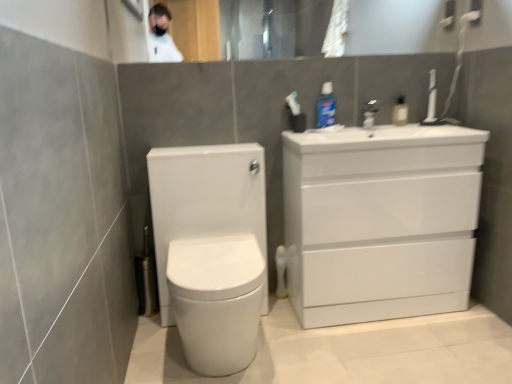
Find the location of `white glossy toilet at center`. white glossy toilet at center is located at coordinates pyautogui.click(x=211, y=249).

Image resolution: width=512 pixels, height=384 pixels. Describe the element at coordinates (326, 107) in the screenshot. I see `blue glossy mouthwash at upper center, the 1th toiletry when ordered from left to right` at that location.

You are a GUI agent. You are given a task and a screenshot of the screen. Output one action in this format:
    pyautogui.click(x=<x>, y=<y>)
    Task: Click on the clear plastic bottle at upper center, which is the 1th toiletry in right-to-left order
    This screenshot has height=384, width=512.
    Given the screenshot: What is the action you would take?
    pyautogui.click(x=400, y=112)

Where is `white glossy cabinet at right`? This screenshot has height=384, width=512. white glossy cabinet at right is located at coordinates (381, 221).

I want to click on white glossy toilet at center, so click(211, 249).

Between satin nickel faucet at upper center and clear plastic bottle at upper center, which is the 1th toiletry in right-to-left order, which one has smaller size?

Smaller between the two is satin nickel faucet at upper center.

Could you tell me if satin nickel faucet at upper center is facing clear plastic bottle at upper center, which is the 1th toiletry in right-to-left order?

No, satin nickel faucet at upper center is not aimed at clear plastic bottle at upper center, which is the 1th toiletry in right-to-left order.

Based on the photo, visually, is satin nickel faucet at upper center positioned to the left or to the right of clear plastic bottle at upper center, which is the 1th toiletry in right-to-left order?

satin nickel faucet at upper center is to the left of clear plastic bottle at upper center, which is the 1th toiletry in right-to-left order.

Considering the relative sizes of satin nickel faucet at upper center and clear plastic bottle at upper center, which is the 1th toiletry in right-to-left order, in the image provided, is satin nickel faucet at upper center thinner than clear plastic bottle at upper center, which is the 1th toiletry in right-to-left order,?

Correct, the width of satin nickel faucet at upper center is less than that of clear plastic bottle at upper center, which is the 1th toiletry in right-to-left order.

Consider the image. From the image's perspective, would you say glossy glass mirror at upper center is shown under white glossy toilet at center?

No, from the image's perspective, glossy glass mirror at upper center is not beneath white glossy toilet at center.

From a real-world perspective, between glossy glass mirror at upper center and white glossy toilet at center, who is vertically higher?

glossy glass mirror at upper center is physically above.

Based on the photo, considering the sizes of glossy glass mirror at upper center and white glossy toilet at center in the image, is glossy glass mirror at upper center bigger or smaller than white glossy toilet at center?

glossy glass mirror at upper center is smaller than white glossy toilet at center.

Would you say glossy glass mirror at upper center is a long distance from white glossy toilet at center?

Indeed, glossy glass mirror at upper center is not near white glossy toilet at center.

From the picture: Does blue glossy mouthwash at upper center, the 1th toiletry when ordered from left to right, have a greater width compared to satin nickel faucet at upper center?

Correct, the width of blue glossy mouthwash at upper center, the 1th toiletry when ordered from left to right, exceeds that of satin nickel faucet at upper center.

How many degrees apart are the facing directions of blue glossy mouthwash at upper center, the 1th toiletry when ordered from left to right, and satin nickel faucet at upper center?

They differ by 0.000755 degrees in their facing directions.

Which point is more distant from viewer, (325, 85) or (367, 124)?

The point (325, 85) is farther.

From the picture: Does blue glossy mouthwash at upper center, which is the second toiletry from right to left, have a smaller size compared to satin nickel faucet at upper center?

Actually, blue glossy mouthwash at upper center, which is the second toiletry from right to left, might be larger than satin nickel faucet at upper center.

Considering the sizes of objects blue glossy mouthwash at upper center, which is the second toiletry from right to left, and white glossy cabinet at right in the image provided, who is thinner, blue glossy mouthwash at upper center, which is the second toiletry from right to left, or white glossy cabinet at right?

Thinner between the two is blue glossy mouthwash at upper center, which is the second toiletry from right to left.

How many degrees apart are the facing directions of blue glossy mouthwash at upper center, the 1th toiletry when ordered from left to right, and white glossy cabinet at right?

0.805 degrees.

Is blue glossy mouthwash at upper center, which is the second toiletry from right to left, oriented away from white glossy cabinet at right?

blue glossy mouthwash at upper center, which is the second toiletry from right to left, is not turned away from white glossy cabinet at right.

Is blue glossy mouthwash at upper center, the 1th toiletry when ordered from left to right, shorter than white glossy cabinet at right?

Correct, blue glossy mouthwash at upper center, the 1th toiletry when ordered from left to right, is not as tall as white glossy cabinet at right.

Does white glossy toilet at center have a smaller size compared to satin nickel faucet at upper center?

Incorrect, white glossy toilet at center is not smaller in size than satin nickel faucet at upper center.

How many degrees apart are the facing directions of white glossy toilet at center and satin nickel faucet at upper center?

They differ by 0.805 degrees in their facing directions.

From the image's perspective, which one is positioned lower, white glossy toilet at center or satin nickel faucet at upper center?

white glossy toilet at center, from the image's perspective.

Are white glossy toilet at center and satin nickel faucet at upper center making contact?

white glossy toilet at center and satin nickel faucet at upper center are not in contact.

In the scene shown: Considering the relative sizes of white glossy cabinet at right and satin nickel faucet at upper center in the image provided, is white glossy cabinet at right thinner than satin nickel faucet at upper center?

In fact, white glossy cabinet at right might be wider than satin nickel faucet at upper center.

Is white glossy cabinet at right in contact with satin nickel faucet at upper center?

No, white glossy cabinet at right is not beside satin nickel faucet at upper center.

In the scene shown: Is white glossy cabinet at right smaller than satin nickel faucet at upper center?

No.

From the image's perspective, is blue glossy mouthwash at upper center, which is the second toiletry from right to left, positioned above or below clear plastic bottle at upper center, the 2th toiletry in the left-to-right sequence?

Clearly, from the image's perspective, blue glossy mouthwash at upper center, which is the second toiletry from right to left, is above clear plastic bottle at upper center, the 2th toiletry in the left-to-right sequence.

Is the surface of blue glossy mouthwash at upper center, which is the second toiletry from right to left, in direct contact with clear plastic bottle at upper center, which is the 1th toiletry in right-to-left order?

blue glossy mouthwash at upper center, which is the second toiletry from right to left, and clear plastic bottle at upper center, which is the 1th toiletry in right-to-left order, are clearly separated.

Which is farther from the camera, (325, 107) or (400, 112)?

Positioned behind is point (400, 112).

I want to click on toiletry that is the 1st one when counting upward from the satin nickel faucet at upper center (from the image's perspective), so click(400, 112).

What are the coordinates of `toilet on the left of glossy glass mirror at upper center` in the screenshot? It's located at (211, 249).

Looking at the image, which one is located further to blue glossy mouthwash at upper center, which is the second toiletry from right to left, clear plastic bottle at upper center, which is the 1th toiletry in right-to-left order, or satin nickel faucet at upper center?

The object further to blue glossy mouthwash at upper center, which is the second toiletry from right to left, is clear plastic bottle at upper center, which is the 1th toiletry in right-to-left order.

When comparing their distances from clear plastic bottle at upper center, the 2th toiletry in the left-to-right sequence, does white glossy toilet at center or white glossy cabinet at right seem closer?

white glossy cabinet at right is positioned closer to the anchor clear plastic bottle at upper center, the 2th toiletry in the left-to-right sequence.

Considering their positions, is clear plastic bottle at upper center, which is the 1th toiletry in right-to-left order, positioned further to satin nickel faucet at upper center than white glossy cabinet at right?

Among the two, white glossy cabinet at right is located further to satin nickel faucet at upper center.

Consider the image. Estimate the real-world distances between objects in this image. Which object is further from blue glossy mouthwash at upper center, which is the second toiletry from right to left, white glossy cabinet at right or glossy glass mirror at upper center?

glossy glass mirror at upper center is positioned further to the anchor blue glossy mouthwash at upper center, which is the second toiletry from right to left.

When comparing their distances from white glossy toilet at center, does glossy glass mirror at upper center or satin nickel faucet at upper center seem further?

The object further to white glossy toilet at center is glossy glass mirror at upper center.

Based on their spatial positions, is glossy glass mirror at upper center or blue glossy mouthwash at upper center, the 1th toiletry when ordered from left to right, closer to satin nickel faucet at upper center?

blue glossy mouthwash at upper center, the 1th toiletry when ordered from left to right, is closer to satin nickel faucet at upper center.

Based on their spatial positions, is glossy glass mirror at upper center or satin nickel faucet at upper center further from blue glossy mouthwash at upper center, the 1th toiletry when ordered from left to right?

glossy glass mirror at upper center is positioned further to the anchor blue glossy mouthwash at upper center, the 1th toiletry when ordered from left to right.

Which object lies further to the anchor point white glossy toilet at center, glossy glass mirror at upper center or white glossy cabinet at right?

glossy glass mirror at upper center lies further to white glossy toilet at center than the other object.

The width and height of the screenshot is (512, 384). Find the location of `tap between glossy glass mirror at upper center and white glossy cabinet at right from top to bottom`. tap between glossy glass mirror at upper center and white glossy cabinet at right from top to bottom is located at coordinates (370, 113).

Image resolution: width=512 pixels, height=384 pixels. What are the coordinates of `toiletry between white glossy toilet at center and clear plastic bottle at upper center, the 2th toiletry in the left-to-right sequence, from left to right` in the screenshot? It's located at (326, 107).

I want to click on tap that lies between blue glossy mouthwash at upper center, the 1th toiletry when ordered from left to right, and white glossy cabinet at right from top to bottom, so [x=370, y=113].

This screenshot has width=512, height=384. I want to click on toiletry between white glossy toilet at center and white glossy cabinet at right, so click(x=326, y=107).